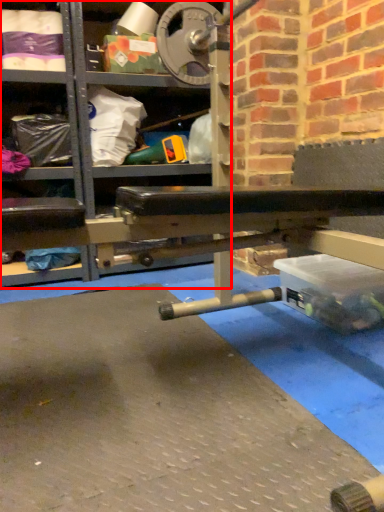
Question: In this image, where is shelf (annotated by the red box) located relative to shelf?

Choices:
 (A) right
 (B) left

Answer: (A)